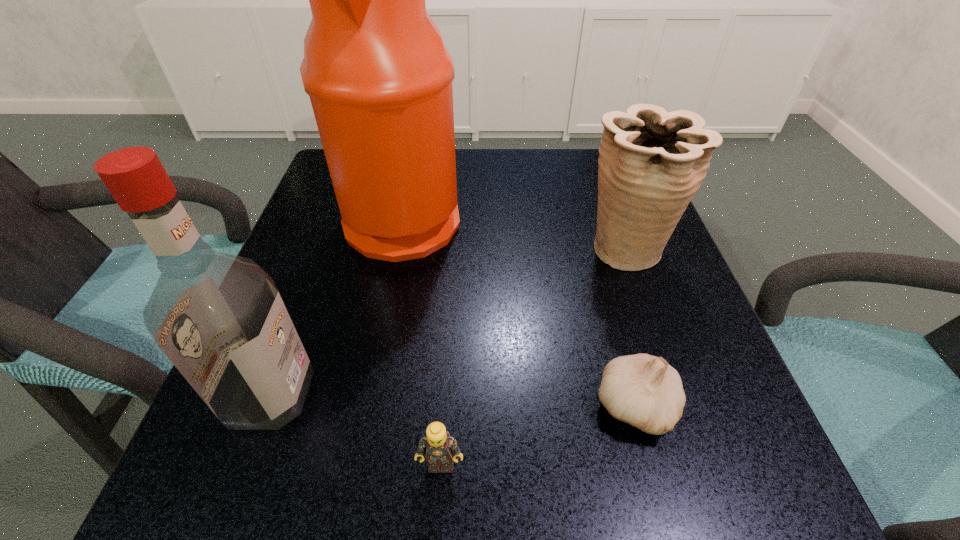
Identify the location of free spot between the garlic and the Lego. The height and width of the screenshot is (540, 960). (538, 435).

You are a GUI agent. You are given a task and a screenshot of the screen. Output one action in this format:
    pyautogui.click(x=<x>, y=<y>)
    Task: Click on the free space between the liquor and the urn
    The height and width of the screenshot is (540, 960).
    Given the screenshot: What is the action you would take?
    point(447,321)

Identify the location of vacant space that is in between the water jug and the liquor. (337, 306).

This screenshot has width=960, height=540. Find the location of `vacant space in between the third tallest object and the fourth shortest object`. vacant space in between the third tallest object and the fourth shortest object is located at coordinates (447, 321).

The width and height of the screenshot is (960, 540). Identify the location of object identified as the fourth closest to the third shortest object. (219, 318).

Locate an element on the screen. Image resolution: width=960 pixels, height=540 pixels. object that can be found as the second closest to the fourth shortest object is located at coordinates (379, 78).

This screenshot has width=960, height=540. In order to click on free space that satisfies the following two spatial constraints: 1. from the spout of the garlic; 2. on the right side of the water jug in this screenshot , I will do `click(366, 407)`.

The height and width of the screenshot is (540, 960). Find the location of `vacant area that satisfies the following two spatial constraints: 1. on the back side of the third shortest object; 2. from the spout of the tallest object`. vacant area that satisfies the following two spatial constraints: 1. on the back side of the third shortest object; 2. from the spout of the tallest object is located at coordinates point(613,218).

Locate an element on the screen. This screenshot has width=960, height=540. blank area in the image that satisfies the following two spatial constraints: 1. from the spout of the third shortest object; 2. on the right side of the tallest object is located at coordinates (397, 248).

Locate an element on the screen. The width and height of the screenshot is (960, 540). free space that satisfies the following two spatial constraints: 1. from the spout of the water jug; 2. on the back side of the third tallest object is located at coordinates (397, 248).